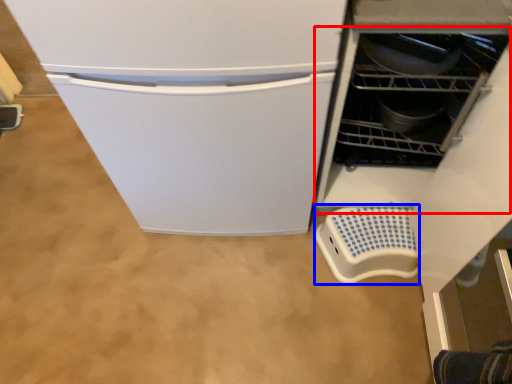
Question: Which object is further to the camera taking this photo, dish washer (highlighted by a red box) or appliance (highlighted by a blue box)?

Choices:
 (A) dish washer
 (B) appliance

Answer: (B)